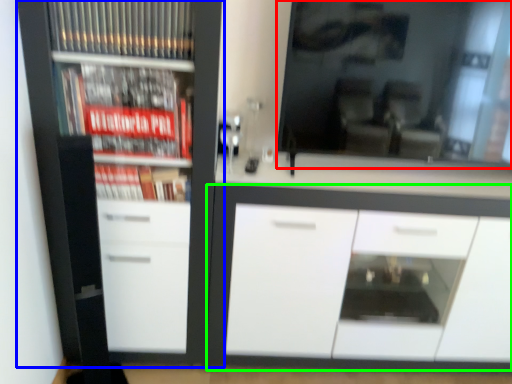
Question: Which object is the farthest from mirror (highlighted by a red box)? Choose among these: cupboard (highlighted by a blue box) or cabinetry (highlighted by a green box).

Choices:
 (A) cupboard
 (B) cabinetry

Answer: (A)